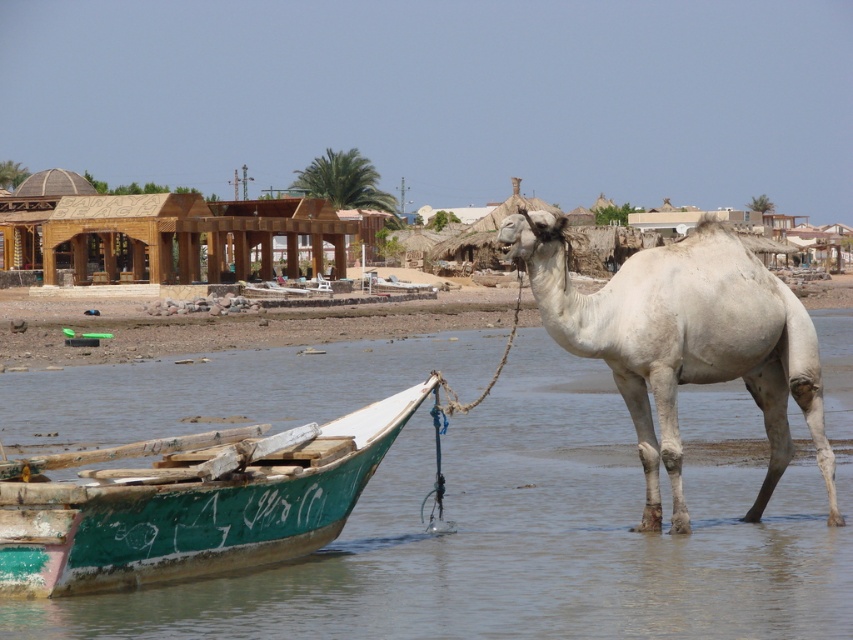
Can you confirm if green painted wood boat at lower left is taller than white matte camel at center?

Indeed, green painted wood boat at lower left has a greater height compared to white matte camel at center.

Between point (281, 545) and point (819, 410), which one is positioned in front?

Point (281, 545) is more forward.

Find the location of a particular element. Image resolution: width=853 pixels, height=640 pixels. green painted wood boat at lower left is located at coordinates (189, 502).

Which is below, clear water at boat right or green painted wood boat at lower left?

green painted wood boat at lower left

In the scene shown: Which is more to the left, clear water at boat right or green painted wood boat at lower left?

green painted wood boat at lower left is more to the left.

Is point (756, 628) less distant than point (161, 532)?

Yes, it is.

The image size is (853, 640). I want to click on clear water at boat right, so click(543, 529).

Does point (390, 480) come closer to viewer compared to point (558, 308)?

That is False.

From the picture: Is clear water at boat right positioned before white matte camel at center?

That is True.

Image resolution: width=853 pixels, height=640 pixels. In order to click on clear water at boat right in this screenshot , I will do `click(543, 529)`.